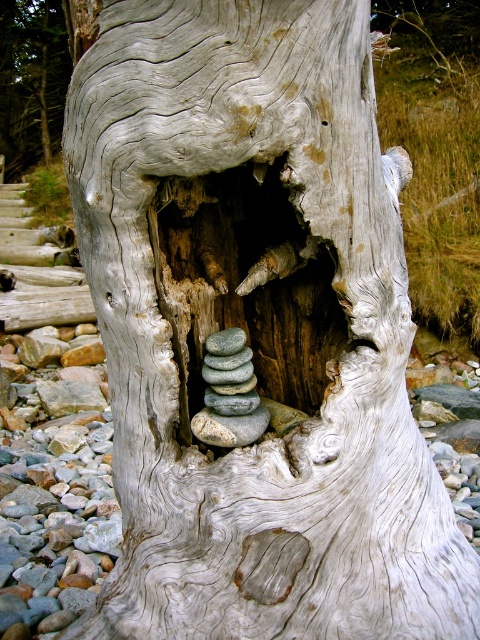
Describe the element at coordinates (243, 301) in the screenshot. Image resolution: width=480 pixels, height=640 pixels. I see `gray wood hole at center` at that location.

Does point (288, 237) come behind point (61, 29)?

That is False.

Measure the distance between point (275, 248) and camera.

Point (275, 248) is 38.85 inches away from camera.

Where is `gray wood hole at center`? This screenshot has width=480, height=640. gray wood hole at center is located at coordinates (243, 301).